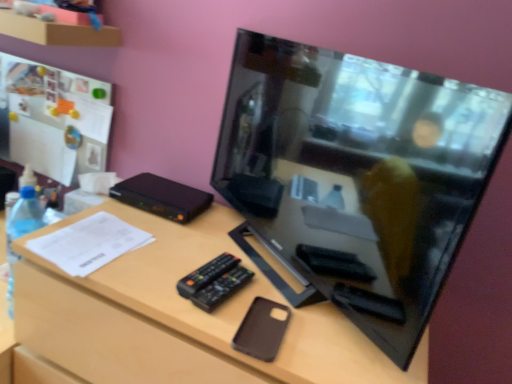
At what (x,y) coordinates should I click in order to perform the action: click on vacant space to the left of brown matte phone case at center. Please return your answer as a coordinate pair (x, y). The height and width of the screenshot is (384, 512). Looking at the image, I should click on (181, 296).